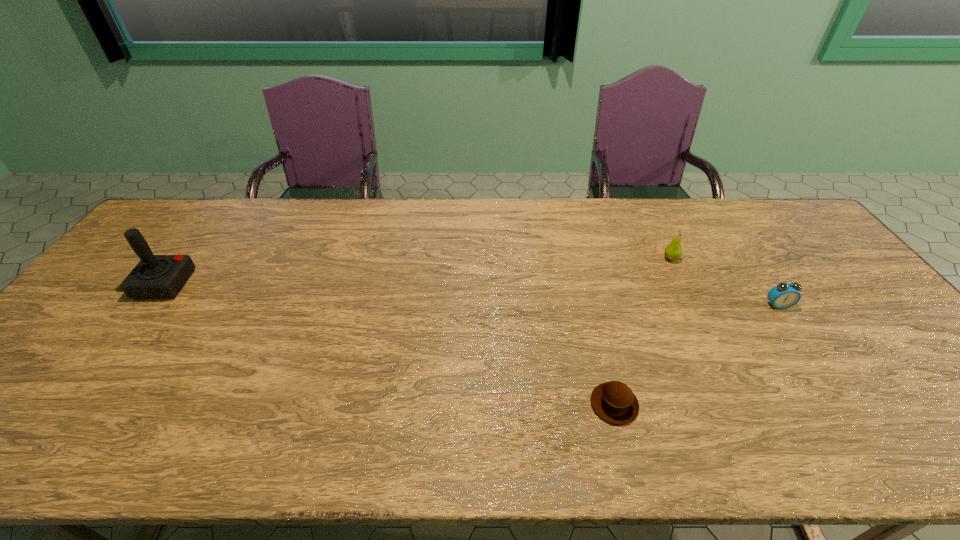
At what (x,y) coordinates should I click in order to perform the action: click on the second farthest object. Please return your answer as a coordinate pair (x, y). The height and width of the screenshot is (540, 960). Looking at the image, I should click on (156, 276).

Where is `joystick`? joystick is located at coordinates (156, 276).

Image resolution: width=960 pixels, height=540 pixels. I want to click on the second tallest object, so click(673, 251).

Find the location of a particular element. the farthest object is located at coordinates click(673, 251).

I want to click on the second nearest object, so pyautogui.click(x=784, y=295).

Locate an element on the screen. This screenshot has height=540, width=960. the rightmost object is located at coordinates (784, 295).

The width and height of the screenshot is (960, 540). Find the location of `the shortest object`. the shortest object is located at coordinates (614, 402).

Locate an element on the screen. the second object from left to right is located at coordinates (614, 402).

Where is `vacant area located 0.350m on the base of the third nearest object`? vacant area located 0.350m on the base of the third nearest object is located at coordinates (308, 284).

The height and width of the screenshot is (540, 960). What are the coordinates of `free space located on the back of the farthest object` in the screenshot? It's located at (653, 221).